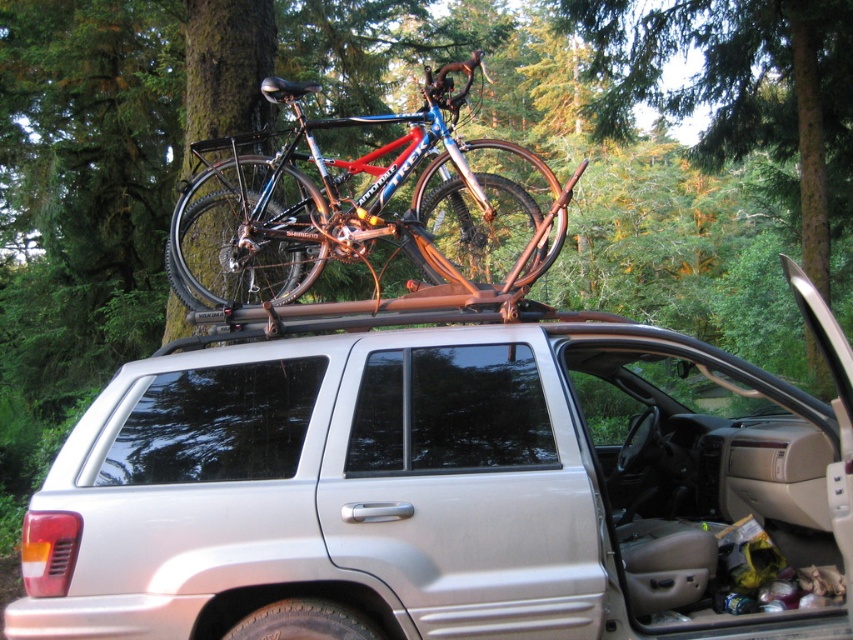
Question: Among these points, which one is nearest to the camera?

Choices:
 (A) (245, 241)
 (B) (454, 413)

Answer: (B)

Question: Can you confirm if silver metallic suv at center is positioned below shiny metallic bicycle at center?

Choices:
 (A) no
 (B) yes

Answer: (B)

Question: Is silver metallic suv at center positioned behind shiny metallic bicycle at center?

Choices:
 (A) yes
 (B) no

Answer: (B)

Question: Does silver metallic suv at center appear over shiny metallic bicycle at center?

Choices:
 (A) no
 (B) yes

Answer: (A)